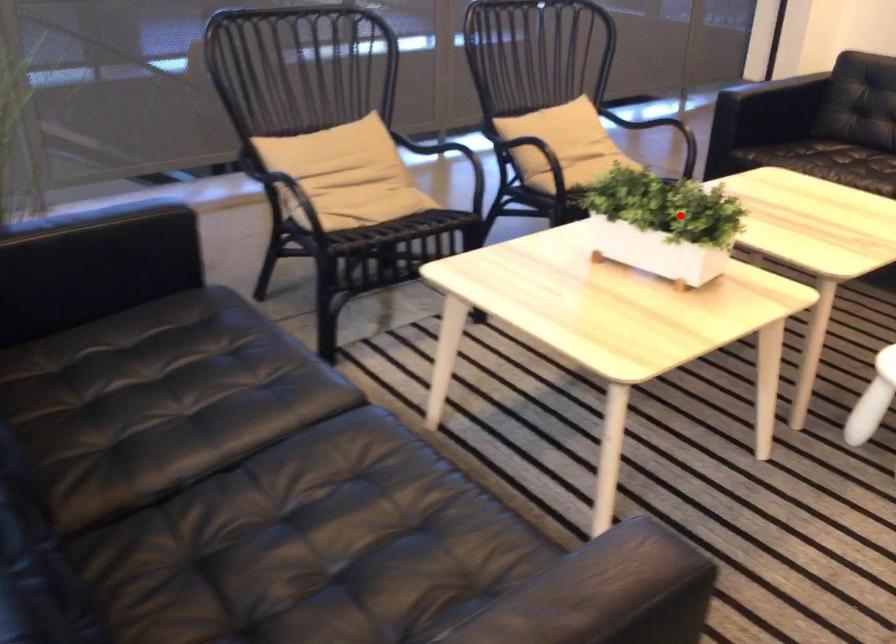
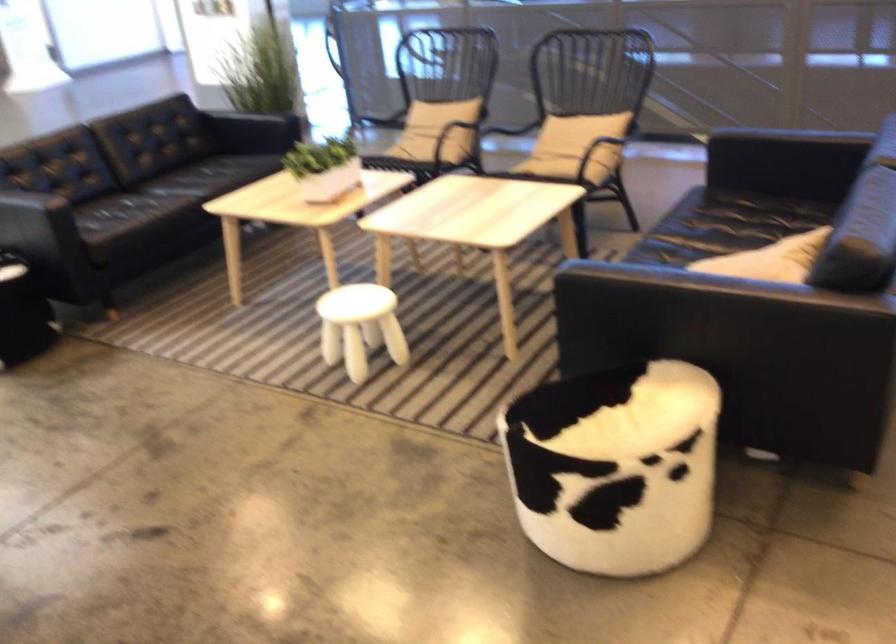
Question: I am providing you with two images of the same scene from different viewpoints. In image1, a red point is highlighted. Considering the same 3D point in image2, which of the following is correct?

Choices:
 (A) It is closer
 (B) It is farther

Answer: (B)